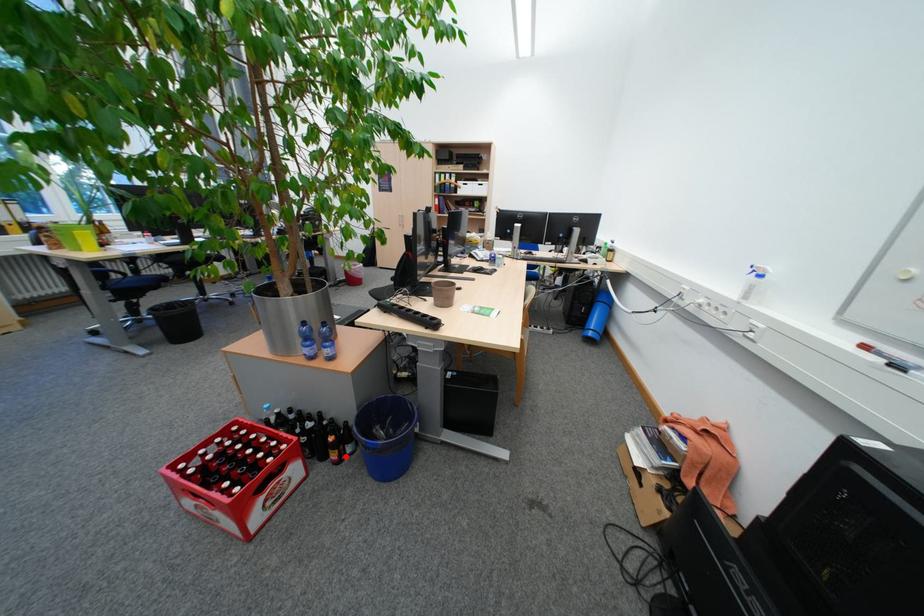
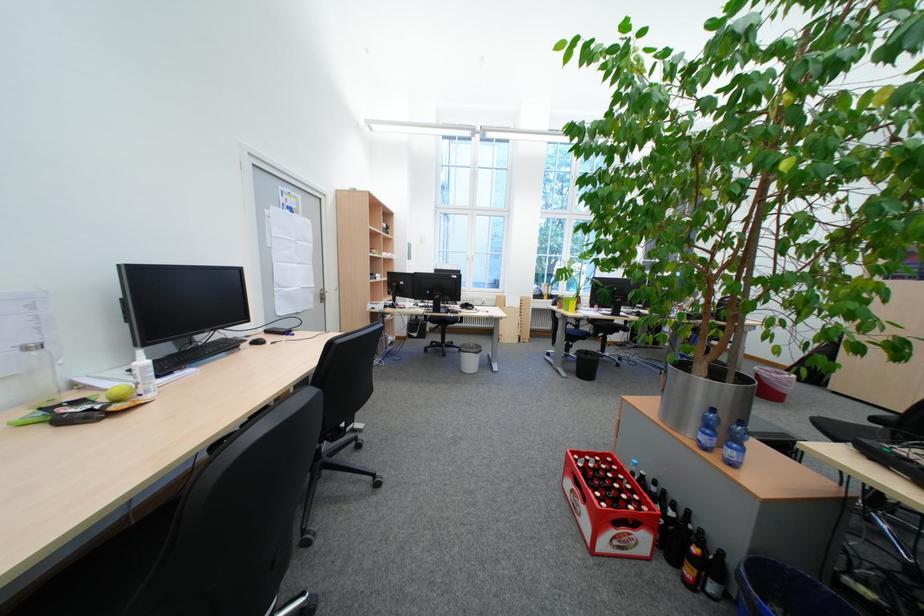
Locate, in the second image, the point that corresponds to the highlighted location in the first image.

(700, 573)